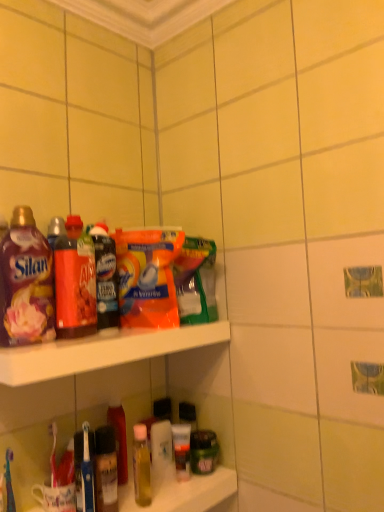
Question: Looking at the image, does translucent plastic bottle at lower center, which ranks as the 1th bottle in bottom-to-top order, seem bigger or smaller compared to matte red bottle at left, the 2th bottle from the top?

Choices:
 (A) big
 (B) small

Answer: (B)

Question: Is translucent plastic bottle at lower center, which ranks as the 1th bottle in bottom-to-top order, situated inside matte red bottle at left, placed as the second bottle when sorted from back to front, or outside?

Choices:
 (A) inside
 (B) outside

Answer: (B)

Question: Estimate the real-world distances between objects in this image. Which object is farther from the matte plastic bottle at left, which appears as the first bottle when viewed from the front?

Choices:
 (A) matte red bottle at left, the 2th bottle from the top
 (B) orange plastic cleaning product at center
 (C) matte plastic bottle at upper left
 (D) translucent plastic bottle at lower center, which is counted as the 3th bottle, starting from the front
 (E) matte plastic shelf at upper center

Answer: (D)

Question: Which is farther from the matte plastic bottle at left, which is the third bottle from back to front?

Choices:
 (A) matte red bottle at left, arranged as the second bottle when ordered from the bottom
 (B) translucent plastic bottle at lower center, which ranks as the 1th bottle in bottom-to-top order
 (C) orange plastic cleaning product at center
 (D) matte plastic shelf at upper center
 (E) matte plastic bottle at upper left

Answer: (B)